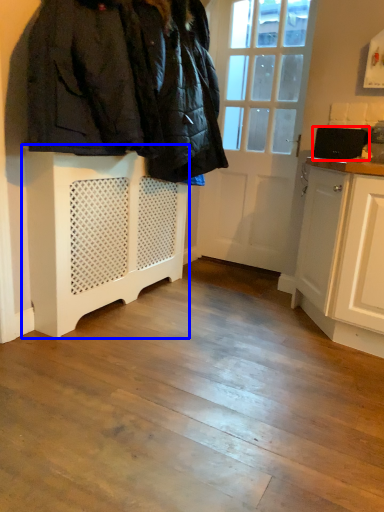
Question: Which of the following is the closest to the observer, appliance (highlighted by a red box) or cabinetry (highlighted by a blue box)?

Choices:
 (A) appliance
 (B) cabinetry

Answer: (B)